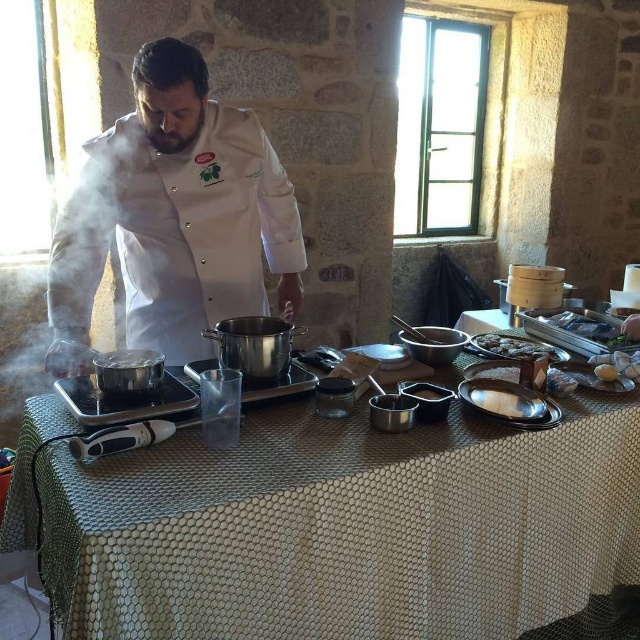
Question: Is white matte chef coat at center thinner than shiny silver tray at right?

Choices:
 (A) yes
 (B) no

Answer: (B)

Question: Which point is farther to the camera?

Choices:
 (A) (611, 381)
 (B) (621, 436)
 (C) (269, 186)

Answer: (C)

Question: Which object is positioned farthest from the white glossy plate at center?

Choices:
 (A) white matte chef coat at center
 (B) white paper towel at lower right

Answer: (A)

Question: Which point is closer to the camera?

Choices:
 (A) (618, 326)
 (B) (132, 177)
 (C) (522, 339)

Answer: (B)

Question: Is metallic silver table at center below white glossy plate at center?

Choices:
 (A) yes
 (B) no

Answer: (A)

Question: Is white matte chef coat at center positioned before white paper towel at lower right?

Choices:
 (A) yes
 (B) no

Answer: (B)